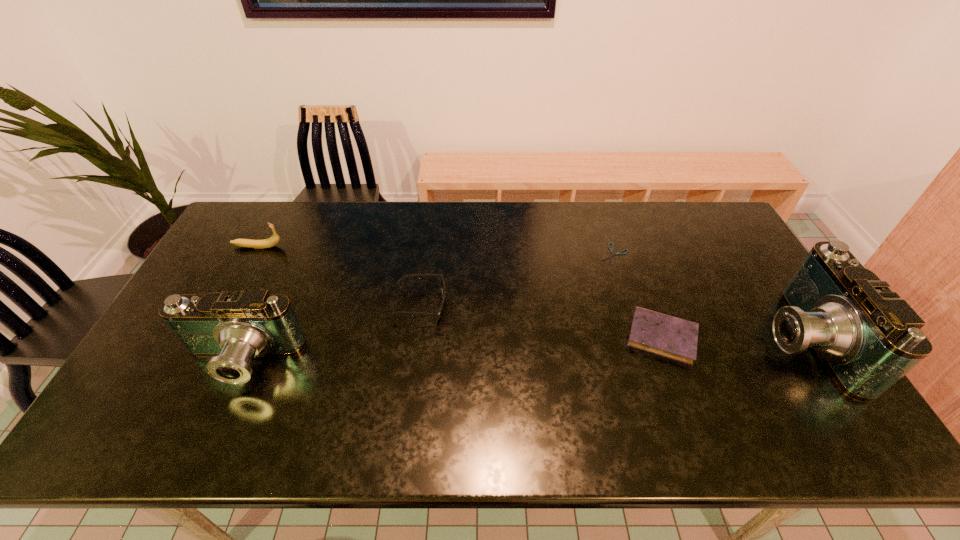
The height and width of the screenshot is (540, 960). Identify the location of vacant point located on the front-facing side of the taller camcorder. (651, 340).

This screenshot has width=960, height=540. In order to click on vacant region located 0.250m on the front-facing side of the taller camcorder in this screenshot , I will do `click(669, 340)`.

The height and width of the screenshot is (540, 960). I want to click on vacant space positioned 0.290m at the stem of the banana, so click(369, 247).

This screenshot has height=540, width=960. Find the location of `vacant space located on the front of the shortest object`. vacant space located on the front of the shortest object is located at coordinates (636, 321).

Where is `free space located 0.050m on the front-facing side of the third object from left to right`? This screenshot has width=960, height=540. free space located 0.050m on the front-facing side of the third object from left to right is located at coordinates (463, 305).

Locate an element on the screen. free space located 0.080m on the right of the diary is located at coordinates (729, 337).

This screenshot has height=540, width=960. I want to click on object located at the far edge, so click(x=619, y=253).

Image resolution: width=960 pixels, height=540 pixels. What are the coordinates of `camcorder situated at the left edge` in the screenshot? It's located at (233, 328).

Where is `banana located in the left edge section of the desktop`? The image size is (960, 540). banana located in the left edge section of the desktop is located at coordinates (274, 239).

You are a GUI agent. You are given a task and a screenshot of the screen. Output one action in this format:
    pyautogui.click(x=<x>, y=<y>)
    Task: Click on the object at the right edge
    This screenshot has width=960, height=540.
    Given the screenshot: What is the action you would take?
    pyautogui.click(x=868, y=338)